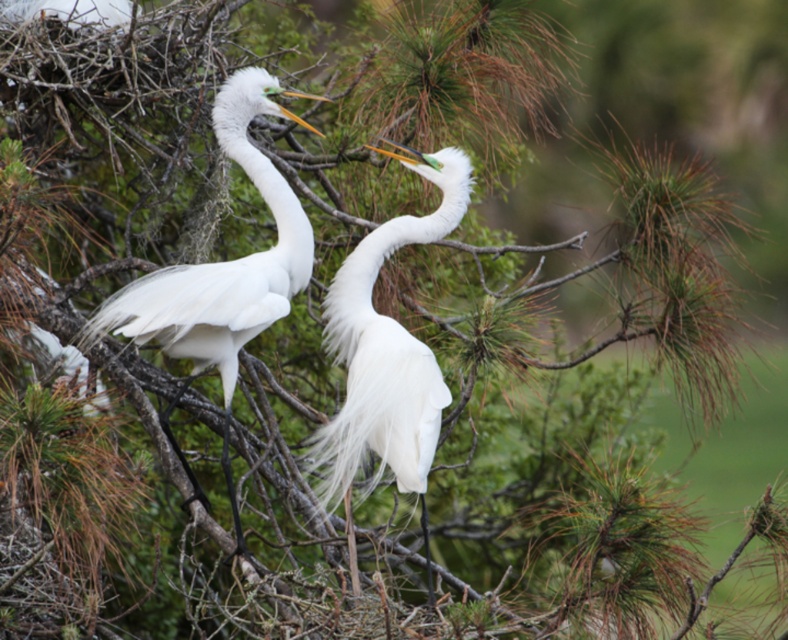
From the picture: Measure the distance between white fluffy egret at center and camera.

They are 4.00 meters apart.

Between point (333, 362) and point (259, 88), which one is positioned in front?

Point (259, 88)

What do you see at coordinates (387, 355) in the screenshot? I see `white fluffy egret at center` at bounding box center [387, 355].

The width and height of the screenshot is (788, 640). I want to click on white fluffy egret at center, so click(x=387, y=355).